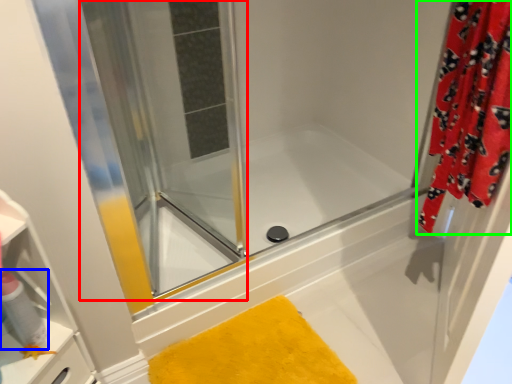
Question: Considering the real-world distances, which object is closest to screen door (highlighted by a red box)? cleaning product (highlighted by a blue box) or curtain (highlighted by a green box).

Choices:
 (A) cleaning product
 (B) curtain

Answer: (B)